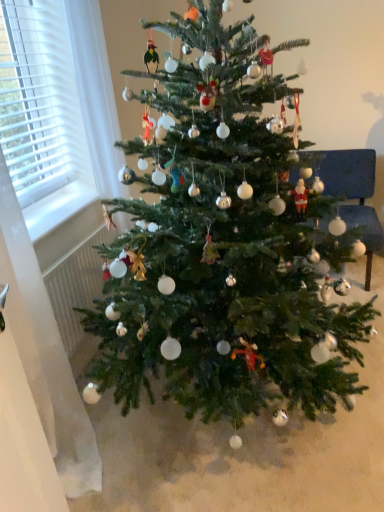
Question: Can green matte christmas tree at center be found inside velvet blue armchair at right?

Choices:
 (A) no
 (B) yes

Answer: (A)

Question: From a real-world perspective, is velvet blue armchair at right on green matte christmas tree at center?

Choices:
 (A) no
 (B) yes

Answer: (A)

Question: Is the position of velvet blue armchair at right more distant than that of green matte christmas tree at center?

Choices:
 (A) no
 (B) yes

Answer: (B)

Question: Does velvet blue armchair at right have a greater height compared to green matte christmas tree at center?

Choices:
 (A) no
 (B) yes

Answer: (A)

Question: Is velvet blue armchair at right bigger than green matte christmas tree at center?

Choices:
 (A) yes
 (B) no

Answer: (B)

Question: Is velvet blue armchair at right far from green matte christmas tree at center?

Choices:
 (A) no
 (B) yes

Answer: (B)

Question: Considering the relative positions of green matte christmas tree at center and velvet blue armchair at right in the image provided, is green matte christmas tree at center to the left of velvet blue armchair at right from the viewer's perspective?

Choices:
 (A) yes
 (B) no

Answer: (A)

Question: Is velvet blue armchair at right at the back of green matte christmas tree at center?

Choices:
 (A) yes
 (B) no

Answer: (B)

Question: Are green matte christmas tree at center and velvet blue armchair at right making contact?

Choices:
 (A) no
 (B) yes

Answer: (A)

Question: Is green matte christmas tree at center to the right of velvet blue armchair at right from the viewer's perspective?

Choices:
 (A) yes
 (B) no

Answer: (B)

Question: Does green matte christmas tree at center have a greater height compared to velvet blue armchair at right?

Choices:
 (A) no
 (B) yes

Answer: (B)

Question: From the image's perspective, is green matte christmas tree at center under velvet blue armchair at right?

Choices:
 (A) yes
 (B) no

Answer: (A)

Question: From a real-world perspective, is green matte christmas tree at center above or below velvet blue armchair at right?

Choices:
 (A) below
 (B) above

Answer: (B)